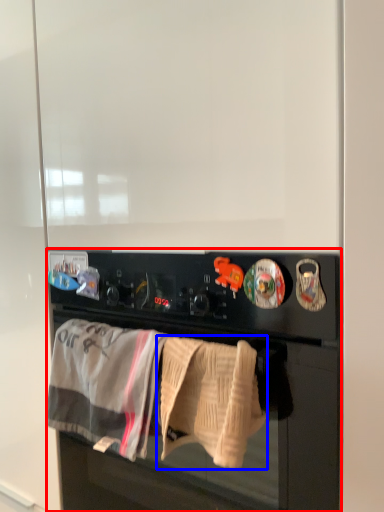
Question: Which object is closer to the camera taking this photo, home appliance (highlighted by a red box) or bath towel (highlighted by a blue box)?

Choices:
 (A) home appliance
 (B) bath towel

Answer: (A)